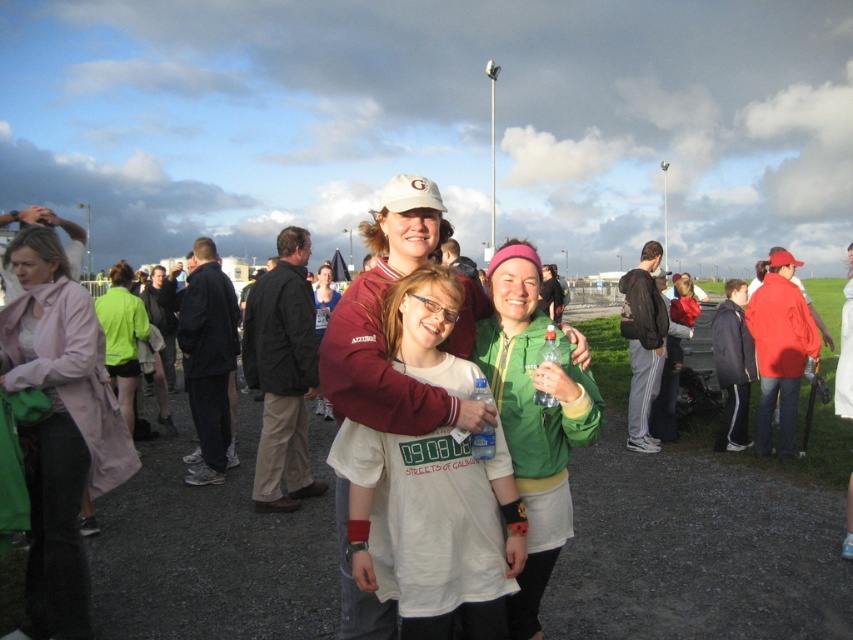
Question: Can you confirm if pink fabric jacket at left is bigger than black fabric jacket at left?

Choices:
 (A) no
 (B) yes

Answer: (B)

Question: Which point is farther to the camera?

Choices:
 (A) green matte jacket at center
 (B) pink fabric jacket at left
 (C) white cotton t-shirt at center
 (D) black fabric jacket at left

Answer: (D)

Question: Which object appears closest to the camera in this image?

Choices:
 (A) pink fabric jacket at left
 (B) green matte jacket at center

Answer: (B)

Question: Does white cotton t-shirt at center lie in front of pink fabric jacket at left?

Choices:
 (A) yes
 (B) no

Answer: (A)

Question: Among these points, which one is farthest from the camera?

Choices:
 (A) (556, 512)
 (B) (436, 346)
 (C) (99, 388)

Answer: (C)

Question: Does pink fabric jacket at left have a lesser width compared to black fabric jacket at left?

Choices:
 (A) yes
 (B) no

Answer: (B)